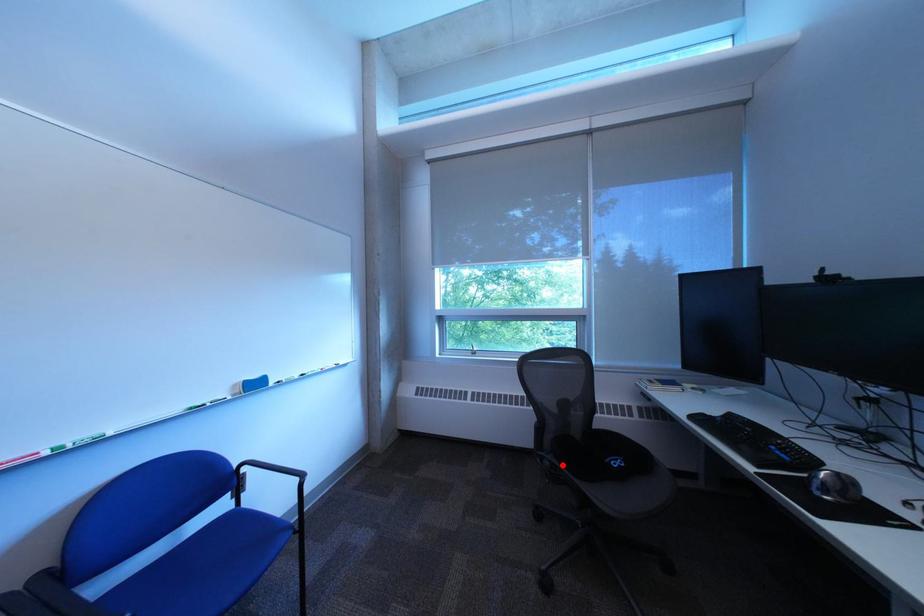
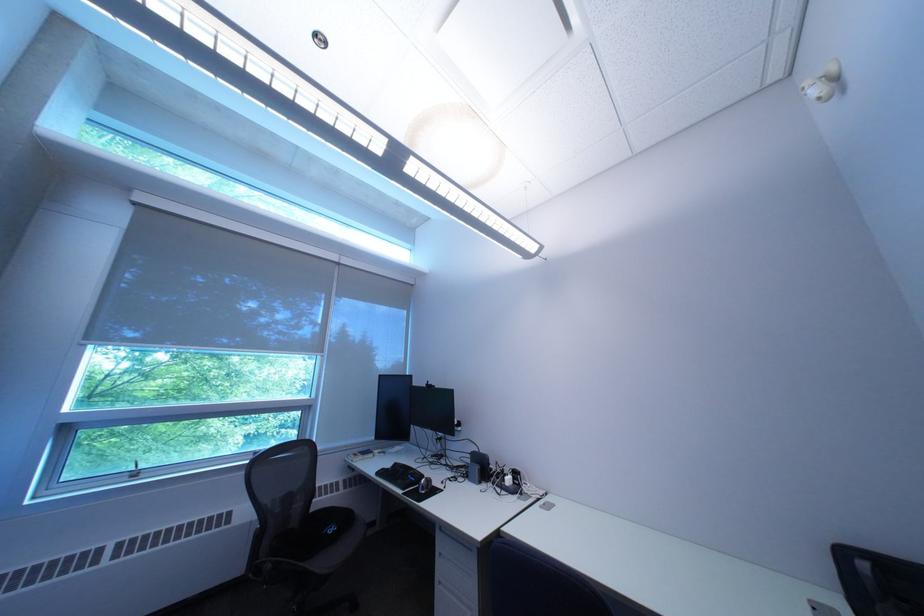
Locate, in the second image, the point that corresponds to the highlighted location in the first image.

(285, 568)